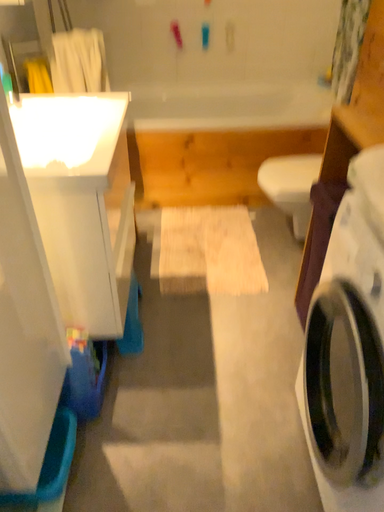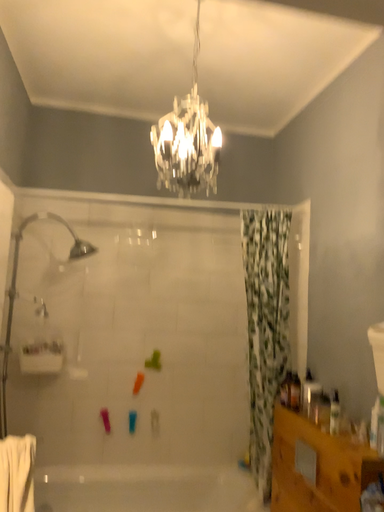
Question: Which way did the camera rotate in the video?

Choices:
 (A) rotated left
 (B) rotated right

Answer: (B)